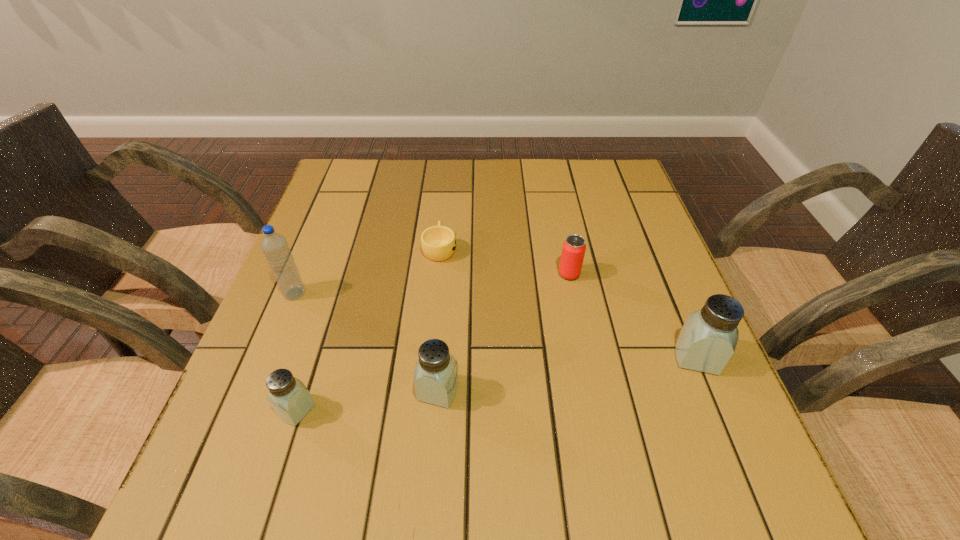
Identify which saltshaker is the second closest to the farthest object. Please provide its 2D coordinates. Your answer should be formatted as a tuple, i.e. [(x, y)], where the tuple contains the x and y coordinates of a point satisfying the conditions above.

[(290, 399)]

Locate an element on the screen. This screenshot has width=960, height=540. vacant point that satisfies the following two spatial constraints: 1. on the back side of the rightmost saltshaker; 2. on the left side of the fourth shortest object is located at coordinates (441, 357).

Where is `vacant position in the image that satisfies the following two spatial constraints: 1. on the back side of the beer can; 2. on the right side of the leftmost saltshaker`? This screenshot has height=540, width=960. vacant position in the image that satisfies the following two spatial constraints: 1. on the back side of the beer can; 2. on the right side of the leftmost saltshaker is located at coordinates (340, 274).

Where is `vacant area in the image that satisfies the following two spatial constraints: 1. on the back side of the fifth object from right to left; 2. on the left side of the cup`? The height and width of the screenshot is (540, 960). vacant area in the image that satisfies the following two spatial constraints: 1. on the back side of the fifth object from right to left; 2. on the left side of the cup is located at coordinates (348, 248).

Find the location of `vacant space that satisfies the following two spatial constraints: 1. on the back side of the second object from right to left; 2. on the left side of the fifth object from right to left`. vacant space that satisfies the following two spatial constraints: 1. on the back side of the second object from right to left; 2. on the left side of the fifth object from right to left is located at coordinates (340, 274).

The width and height of the screenshot is (960, 540). What are the coordinates of `free point that satisfies the following two spatial constraints: 1. on the back side of the fourth shortest object; 2. on the right side of the fifth object from left to right` in the screenshot? It's located at (447, 274).